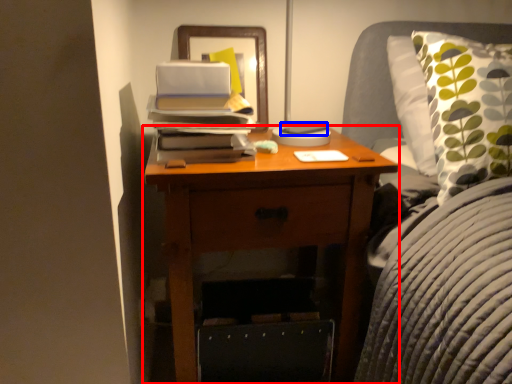
Question: Which object appears farthest to the camera in this image, nightstand (highlighted by a red box) or paperback book (highlighted by a blue box)?

Choices:
 (A) nightstand
 (B) paperback book

Answer: (B)